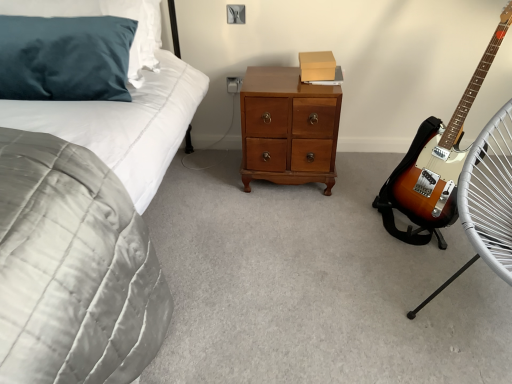
You are a GUI agent. You are given a task and a screenshot of the screen. Output one action in this format:
    pyautogui.click(x=<x>, y=<y>)
    Task: Click on the vacant area that is situated to the right of shiny brown wooden chest of drawers at center
    Image resolution: width=512 pixels, height=384 pixels.
    Given the screenshot: What is the action you would take?
    pyautogui.click(x=360, y=166)